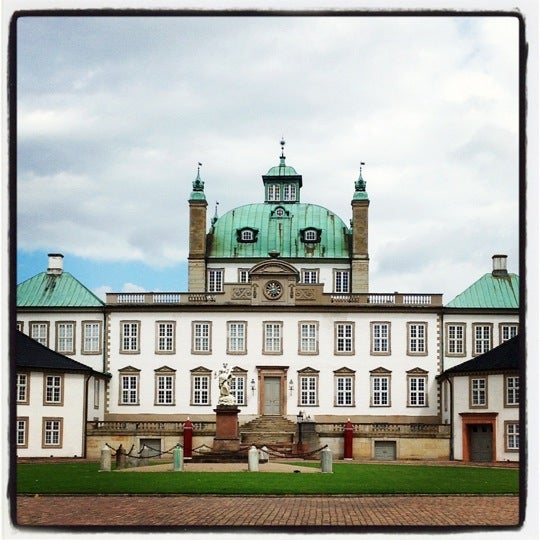
The width and height of the screenshot is (540, 540). In order to click on statue in this screenshot , I will do `click(224, 378)`.